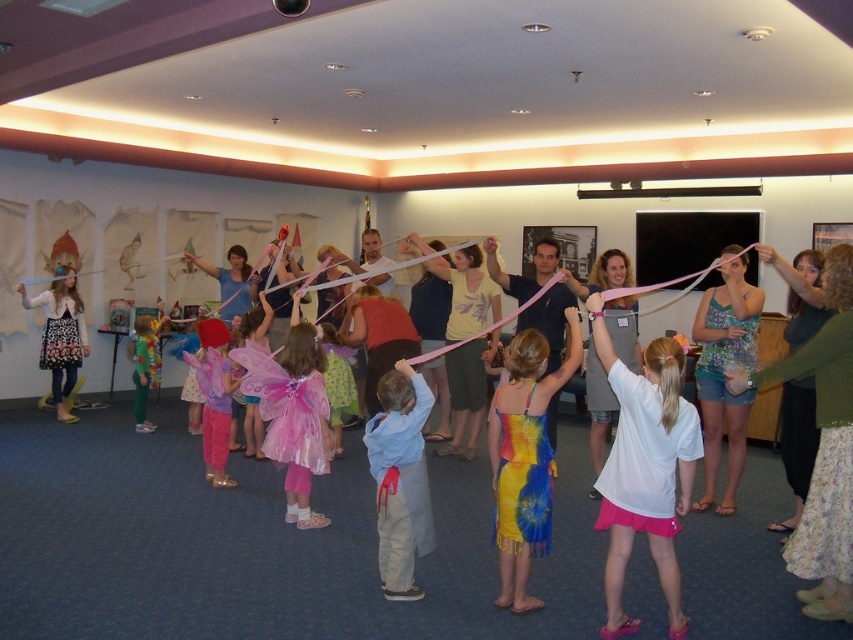
Is white matte t-shirt at center taller than floral dress at left?

Incorrect, white matte t-shirt at center's height is not larger of floral dress at left's.

Between white matte t-shirt at center and floral dress at left, which one is positioned higher?

Positioned higher is floral dress at left.

Where is `white matte t-shirt at center`? This screenshot has height=640, width=853. white matte t-shirt at center is located at coordinates (645, 468).

At what (x,y) coordinates should I click in order to perform the action: click on white matte t-shirt at center. Please return your answer as a coordinate pair (x, y). The height and width of the screenshot is (640, 853). Looking at the image, I should click on (645, 468).

This screenshot has width=853, height=640. What do you see at coordinates (645, 468) in the screenshot?
I see `white matte t-shirt at center` at bounding box center [645, 468].

Which is behind, point (613, 592) or point (494, 524)?

Positioned behind is point (494, 524).

This screenshot has height=640, width=853. What are the coordinates of `white matte t-shirt at center` in the screenshot? It's located at (645, 468).

Who is positioned more to the left, tie-dye fabric dress at center or floral dress at left?

floral dress at left is more to the left.

Can you confirm if tie-dye fabric dress at center is positioned above floral dress at left?

Incorrect, tie-dye fabric dress at center is not positioned above floral dress at left.

Does point (496, 467) come closer to viewer compared to point (57, 276)?

Yes.

Locate an element on the screen. This screenshot has height=640, width=853. tie-dye fabric dress at center is located at coordinates (525, 458).